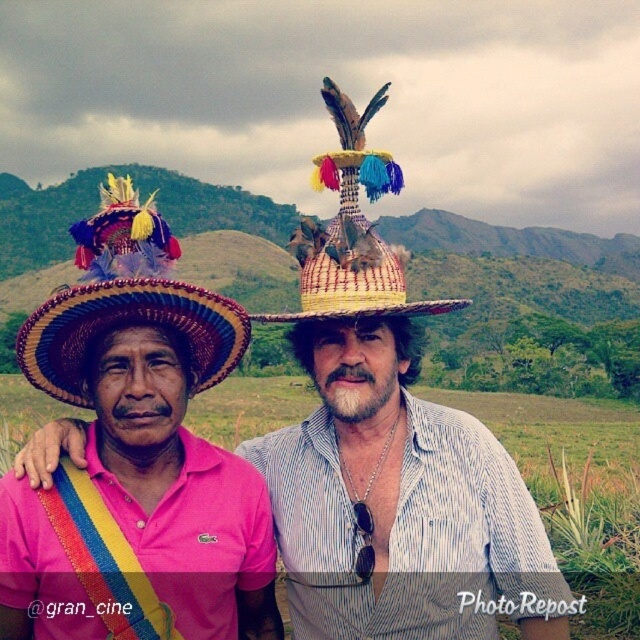
Question: Is woven straw hat at left to the left of bright yellow woven hat at center from the viewer's perspective?

Choices:
 (A) yes
 (B) no

Answer: (A)

Question: Considering the relative positions of woven straw hat at left and bright yellow woven hat at center in the image provided, where is woven straw hat at left located with respect to bright yellow woven hat at center?

Choices:
 (A) left
 (B) right

Answer: (A)

Question: Which point appears closest to the camera in this image?

Choices:
 (A) (330, 266)
 (B) (120, 230)

Answer: (B)

Question: Does woven straw hat at left have a greater width compared to bright yellow woven hat at center?

Choices:
 (A) yes
 (B) no

Answer: (B)